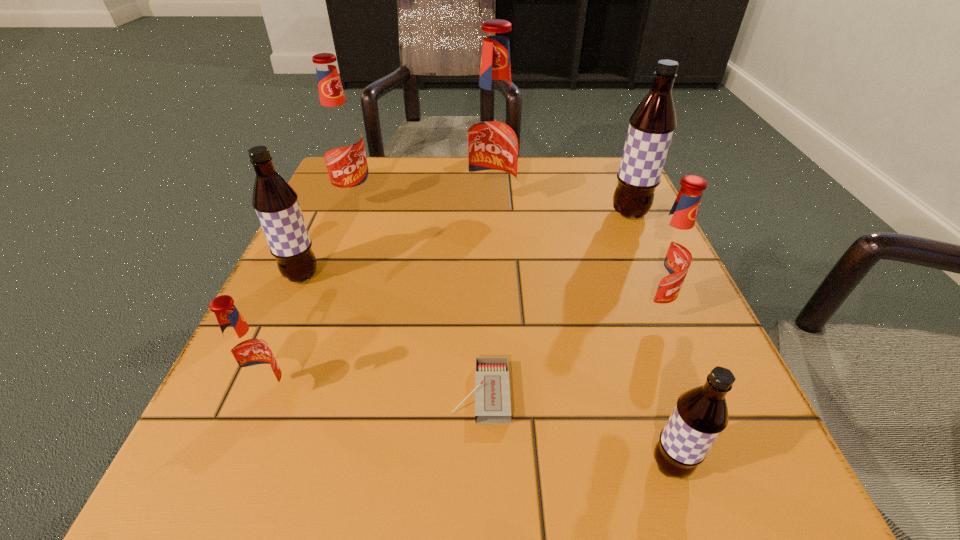
At what (x,y) coordinates should I click in order to perform the action: click on free space located on the back of the smallest red root beer. Please return your answer as a coordinate pair (x, y). The image size is (960, 540). Looking at the image, I should click on (336, 232).

You are a GUI agent. You are given a task and a screenshot of the screen. Output one action in this format:
    pyautogui.click(x=<x>, y=<y>)
    Task: Click on the free spot located 0.060m on the right of the nearest root beer
    The width and height of the screenshot is (960, 540).
    Given the screenshot: What is the action you would take?
    pyautogui.click(x=741, y=465)

You are a GUI agent. You are given a task and a screenshot of the screen. Output one action in this format:
    pyautogui.click(x=<x>, y=<y>)
    Task: Click on the free space located on the striking surface of the white matchbox
    This screenshot has width=960, height=540.
    Given the screenshot: What is the action you would take?
    pyautogui.click(x=344, y=393)

Locate an element on the screen. This screenshot has height=540, width=960. vacant space situated on the striking surface of the white matchbox is located at coordinates (227, 393).

Find the location of `vacant region located on the striking surface of the white matchbox`. vacant region located on the striking surface of the white matchbox is located at coordinates (263, 393).

Image resolution: width=960 pixels, height=540 pixels. I want to click on object present at the near edge, so click(x=701, y=414).

You are a GUI agent. You are given a task and a screenshot of the screen. Output one action in this format:
    pyautogui.click(x=<x>, y=<y>)
    Task: Click on the object that is at the far left corner
    Image resolution: width=960 pixels, height=540 pixels.
    Given the screenshot: What is the action you would take?
    pyautogui.click(x=341, y=140)

The width and height of the screenshot is (960, 540). Identify the location of object at the far right corner. (652, 125).

The image size is (960, 540). Find the location of `object located in the near right corner section of the desktop`. object located in the near right corner section of the desktop is located at coordinates (701, 414).

I want to click on vacant space at the far edge of the desktop, so click(x=451, y=193).